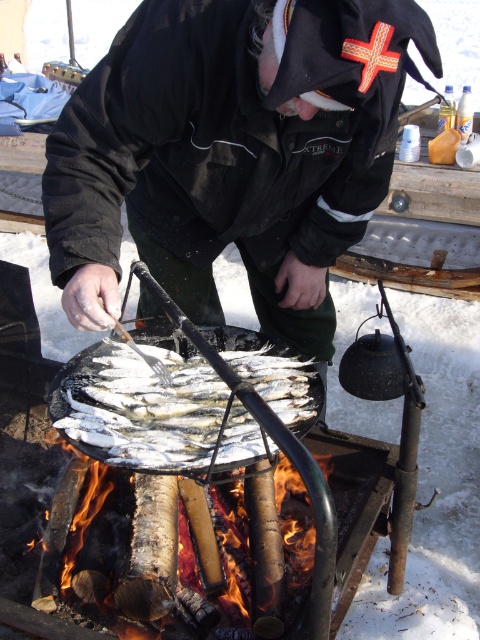
You are a chef preparing a meal and need to know which item is lower in height between the silver metallic fish at center and the charcoal wood fire at lower left. Based on the scene, which one is shorter?

The silver metallic fish at center has a lesser height compared to the charcoal wood fire at lower left, so the silver metallic fish at center is shorter.

You are a chef preparing a meal and need to adjust the cooking time for the silver metallic fish at center. Since the charcoal wood fire at lower left is your only heat source, can you move the fish closer to the fire to cook faster?

The charcoal wood fire at lower left is behind the silver metallic fish at center, so you can move the fish closer to the fire to cook faster by adjusting their positions.